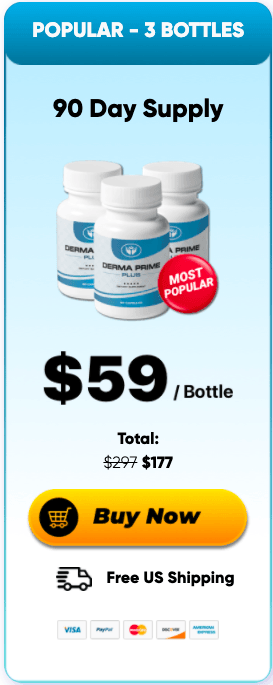
Where is `bottle`? Image resolution: width=273 pixels, height=685 pixels. bottle is located at coordinates (x=106, y=290).